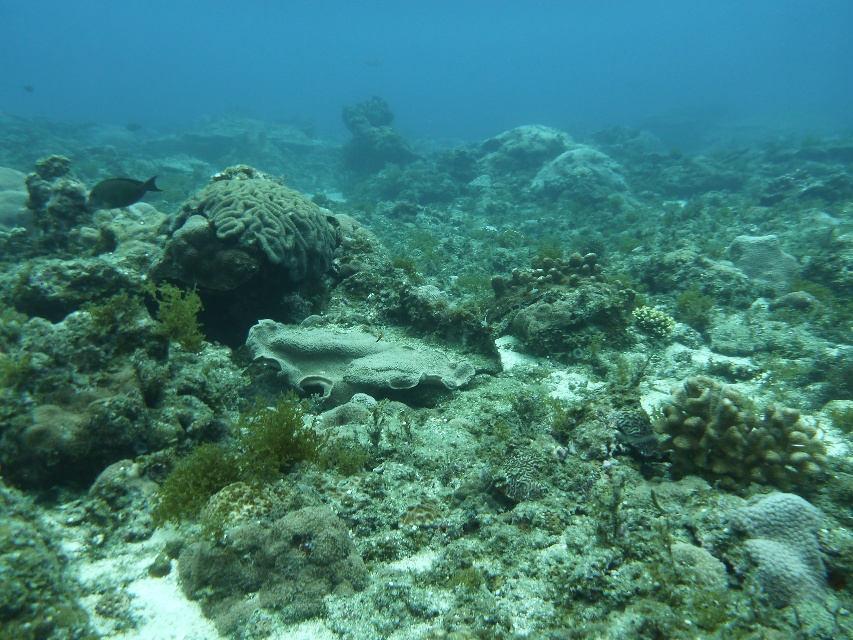
Is green textured coral at center in front of green matte algae at center?

That is False.

Between green textured coral at center and green matte algae at center, which one has less height?

green matte algae at center

The image size is (853, 640). Describe the element at coordinates (245, 232) in the screenshot. I see `green textured coral at center` at that location.

What are the coordinates of `green textured coral at center` in the screenshot? It's located at (245, 232).

Between brown coral at lower right and green matte algae at center, which one is positioned higher?

brown coral at lower right

Is point (722, 474) positioned before point (231, 468)?

No, it is not.

Who is more distant from viewer, (665,442) or (190,513)?

The point (665,442) is more distant.

Locate an element on the screen. Image resolution: width=853 pixels, height=640 pixels. brown coral at lower right is located at coordinates (737, 436).

Does brown coral at lower right have a lesser width compared to gray porous coral at center?

Correct, brown coral at lower right's width is less than gray porous coral at center's.

Who is more distant from viewer, (766, 436) or (379, 337)?

Point (379, 337)

Locate an element on the screen. This screenshot has height=640, width=853. brown coral at lower right is located at coordinates click(737, 436).